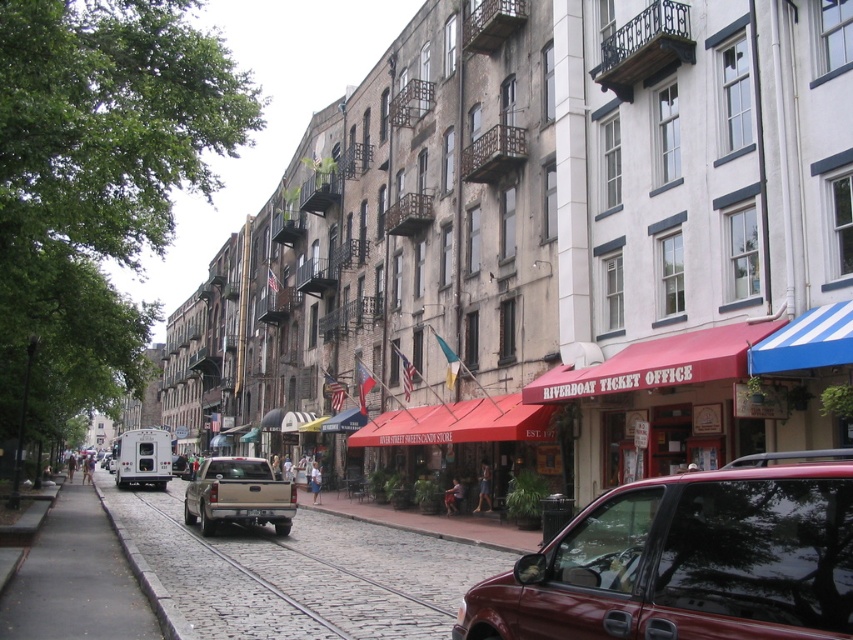
Question: Does shiny red car at lower right appear on the right side of gray cobblestone pavement at lower left?

Choices:
 (A) no
 (B) yes

Answer: (B)

Question: Which object is closer to the camera taking this photo?

Choices:
 (A) tan matte truck at center
 (B) shiny red car at lower right

Answer: (B)

Question: Which object appears closest to the camera in this image?

Choices:
 (A) tan matte truck at center
 (B) cobblestone street at center

Answer: (B)

Question: Is gray cobblestone pavement at lower left above tan matte truck at center?

Choices:
 (A) no
 (B) yes

Answer: (B)

Question: Among these points, which one is farthest from the camera?

Choices:
 (A) (268, 484)
 (B) (764, 500)
 (C) (247, 605)
 (D) (152, 632)

Answer: (A)

Question: Is shiny red car at lower right above cobblestone street at center?

Choices:
 (A) yes
 (B) no

Answer: (A)